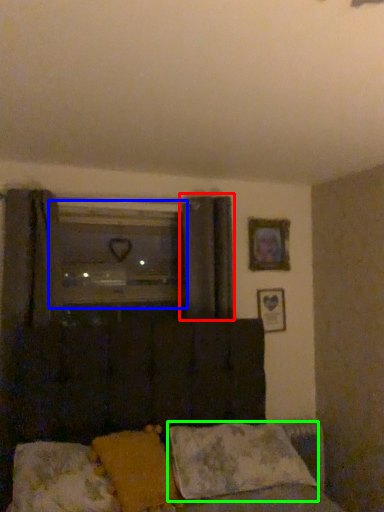
Question: Which object is positioned farthest from curtain (highlighted by a red box)? Select from window (highlighted by a blue box) and pillow (highlighted by a green box).

Choices:
 (A) window
 (B) pillow

Answer: (B)